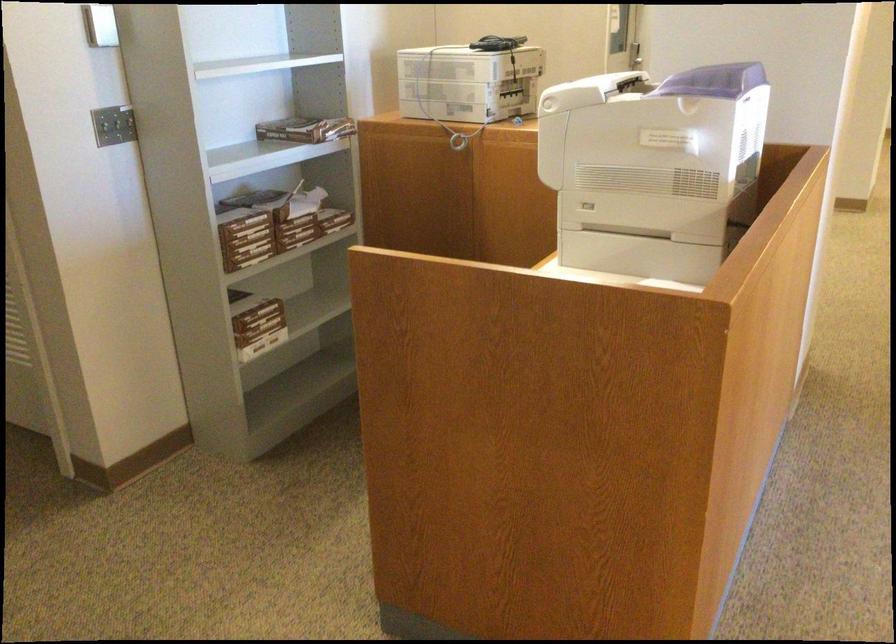
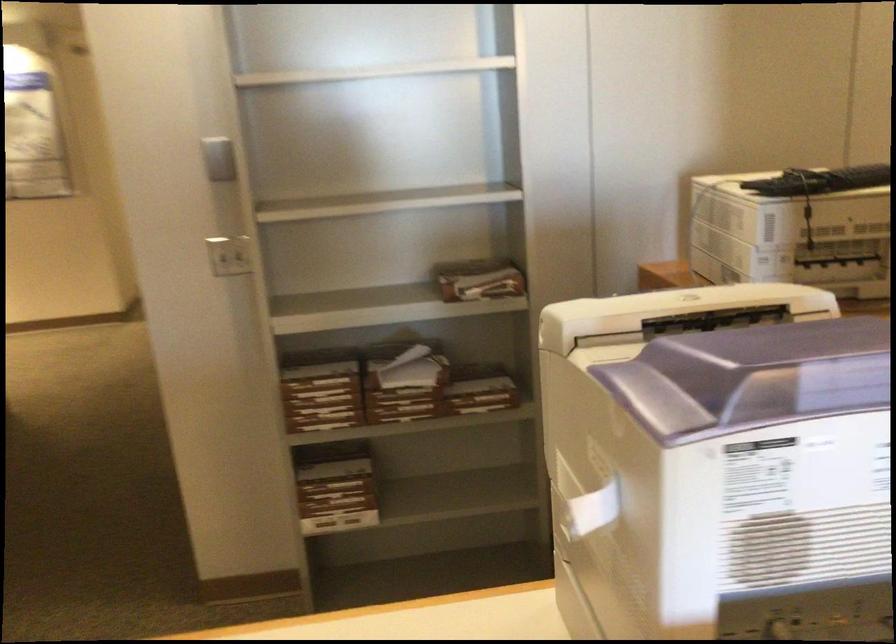
Locate, in the second image, the point that corresponds to pixel 263 310 in the first image.

(334, 488)